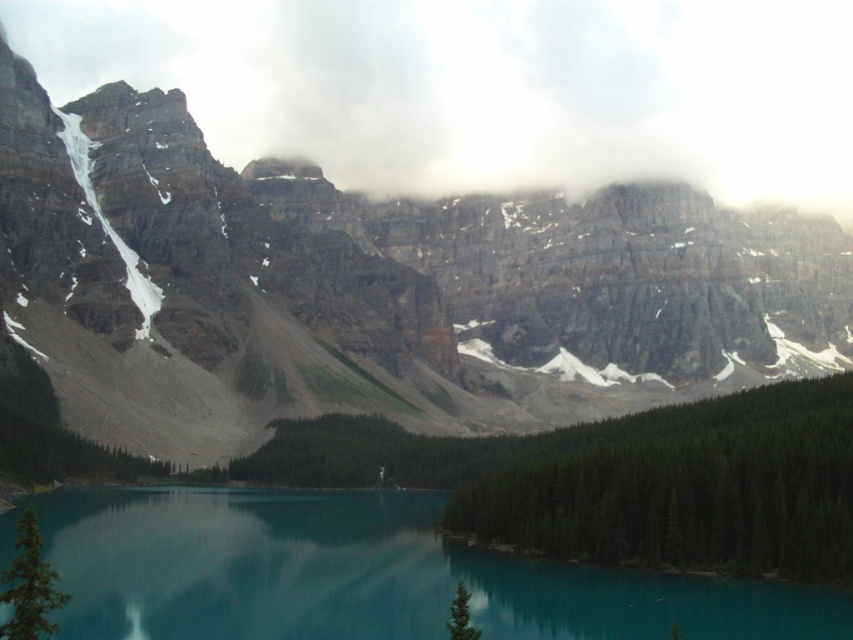
Question: Based on their relative distances, which object is nearer to the rocky cliff at center?

Choices:
 (A) teal glassy water at center
 (B) white fluffy cloud at upper center

Answer: (B)

Question: Is white fluffy cloud at upper center further to the viewer compared to teal glassy water at center?

Choices:
 (A) yes
 (B) no

Answer: (A)

Question: Among these objects, which one is nearest to the camera?

Choices:
 (A) teal glassy water at center
 (B) white fluffy cloud at upper center

Answer: (A)

Question: Which of the following is the closest to the observer?

Choices:
 (A) rocky cliff at center
 (B) white fluffy cloud at upper center
 (C) teal glassy water at center

Answer: (C)

Question: Does rocky cliff at center come behind teal glassy water at center?

Choices:
 (A) yes
 (B) no

Answer: (A)

Question: Is rocky cliff at center bigger than teal glassy water at center?

Choices:
 (A) no
 (B) yes

Answer: (B)